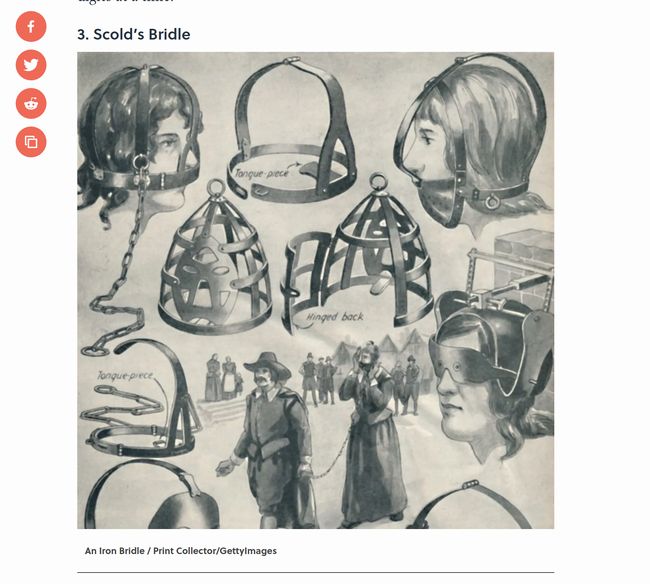
Where is `stairs`? This screenshot has height=584, width=650. stairs is located at coordinates (218, 411).